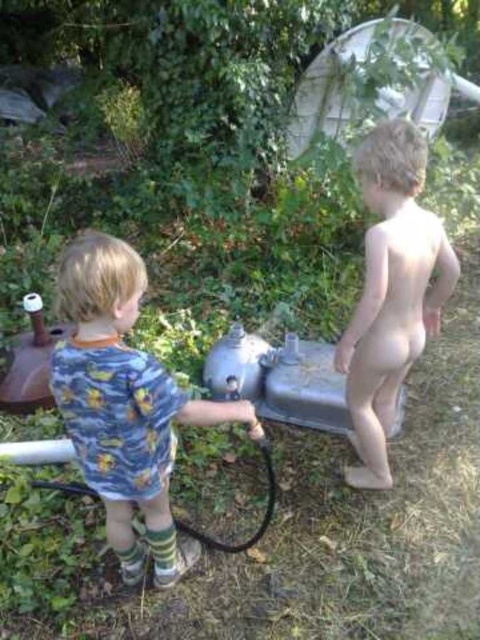
Question: Considering the real-world distances, which object is closest to the blue printed shirt at center?

Choices:
 (A) black rubber hose at lower left
 (B) pale skin nude boy at right

Answer: (A)

Question: Does blue printed shirt at center have a greater width compared to pale skin nude boy at right?

Choices:
 (A) no
 (B) yes

Answer: (B)

Question: Which point is closer to the camera?

Choices:
 (A) pale skin nude boy at right
 (B) blue printed shirt at center
 (C) black rubber hose at lower left

Answer: (B)

Question: Does blue printed shirt at center have a smaller size compared to black rubber hose at lower left?

Choices:
 (A) no
 (B) yes

Answer: (A)

Question: Which point appears closest to the camera in this image?

Choices:
 (A) (374, 332)
 (B) (104, 280)

Answer: (B)

Question: Observing the image, what is the correct spatial positioning of pale skin nude boy at right in reference to black rubber hose at lower left?

Choices:
 (A) below
 (B) above

Answer: (B)